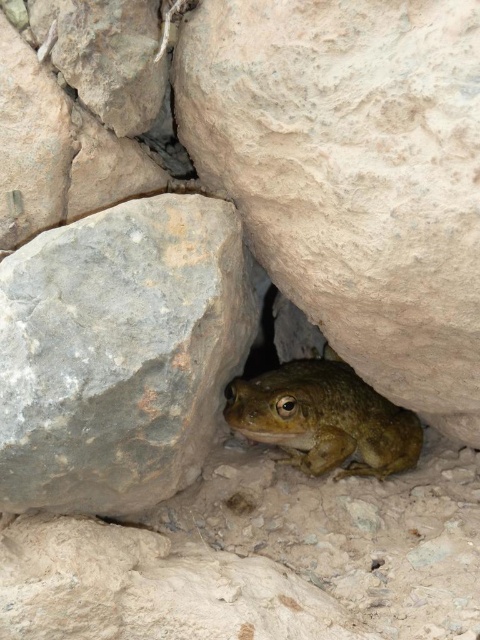
Does rough textured rock at center have a smaller size compared to greenish-brown textured frog at center?

No.

Image resolution: width=480 pixels, height=640 pixels. In order to click on rough textured rock at center in this screenshot , I will do `click(352, 176)`.

Who is higher up, gray rough rock at center or greenish-brown textured frog at center?

gray rough rock at center is above.

Based on the photo, does gray rough rock at center have a lesser height compared to greenish-brown textured frog at center?

No, gray rough rock at center is not shorter than greenish-brown textured frog at center.

Is point (82, 240) positioned behind point (273, 404)?

No, it is in front of (273, 404).

Find the location of `gray rough rock at center`. gray rough rock at center is located at coordinates (120, 353).

Which is in front, point (333, 83) or point (220, 346)?

Point (333, 83) is in front.

Does point (218, 86) come closer to viewer compared to point (238, 243)?

That is True.

Image resolution: width=480 pixels, height=640 pixels. Find the location of `rough textured rock at center`. rough textured rock at center is located at coordinates (352, 176).